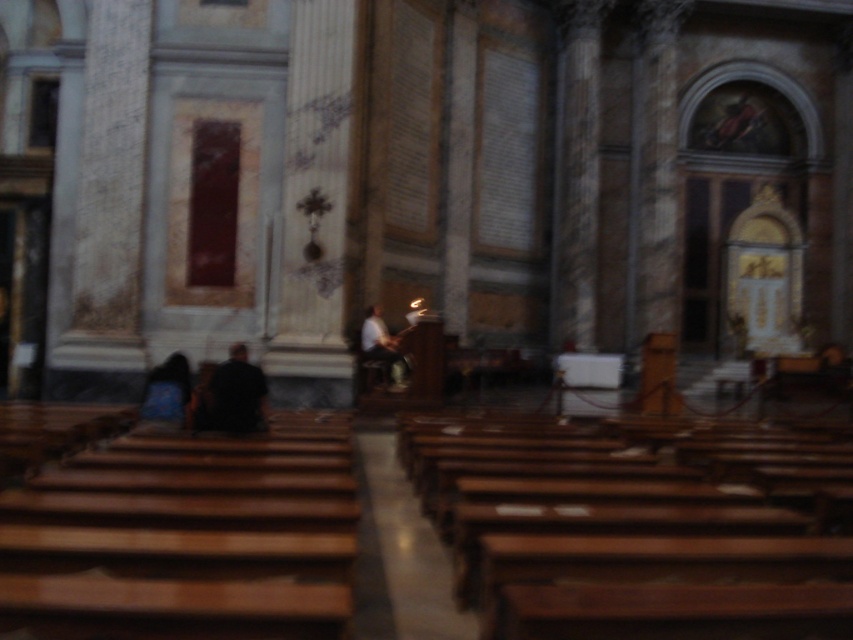
Question: Which object appears farthest from the camera in this image?

Choices:
 (A) white matte shirt at center
 (B) black matte shirt at center
 (C) blue fabric bag at lower left

Answer: (A)

Question: Can you confirm if black matte shirt at center is bigger than blue fabric bag at lower left?

Choices:
 (A) no
 (B) yes

Answer: (A)

Question: Does black matte shirt at center have a lesser width compared to white matte shirt at center?

Choices:
 (A) no
 (B) yes

Answer: (B)

Question: Which point is farther from the camera taking this photo?

Choices:
 (A) (247, 424)
 (B) (178, 408)

Answer: (B)

Question: Which is nearer to the white matte shirt at center?

Choices:
 (A) black matte shirt at center
 (B) blue fabric bag at lower left

Answer: (B)

Question: Where is black matte shirt at center located in relation to white matte shirt at center in the image?

Choices:
 (A) right
 (B) left

Answer: (B)